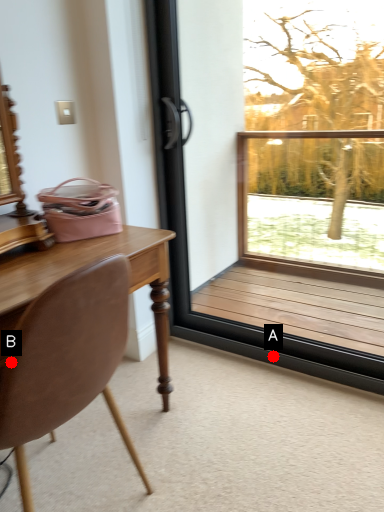
Question: Two points are circled on the image, labeled by A and B beside each circle. Which point is closer to the camera?

Choices:
 (A) A is closer
 (B) B is closer

Answer: (B)